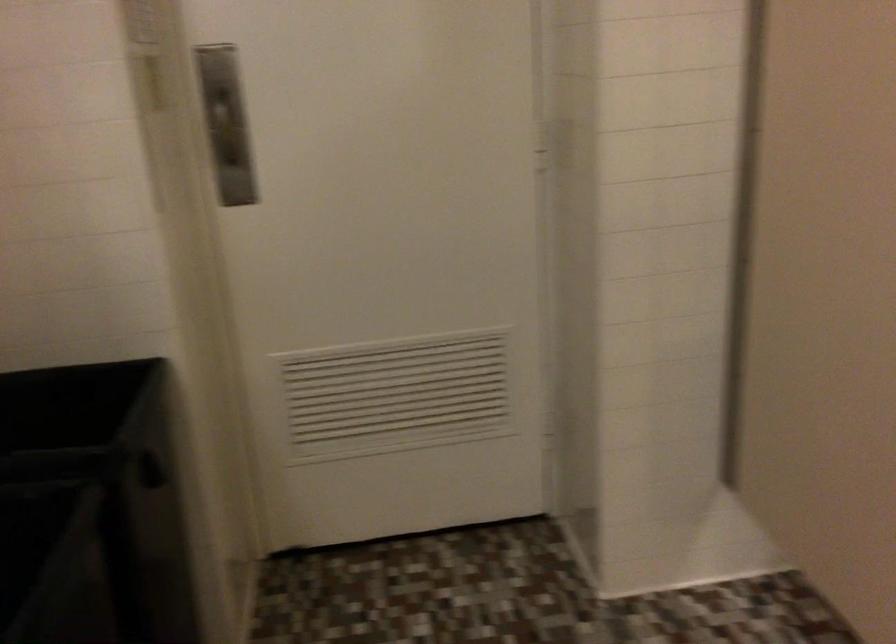
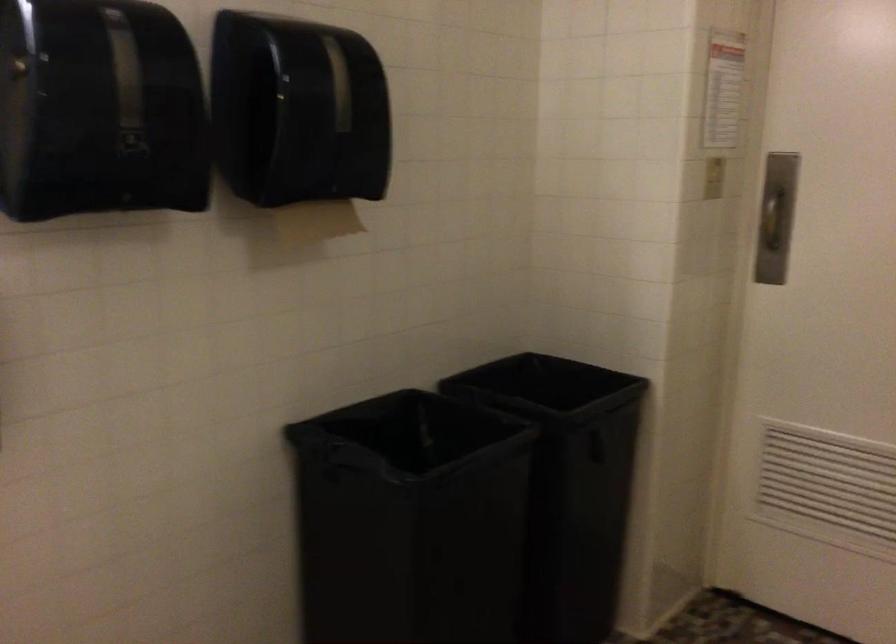
In the second image, find the point that corresponds to pixel 159 89 in the first image.

(713, 178)